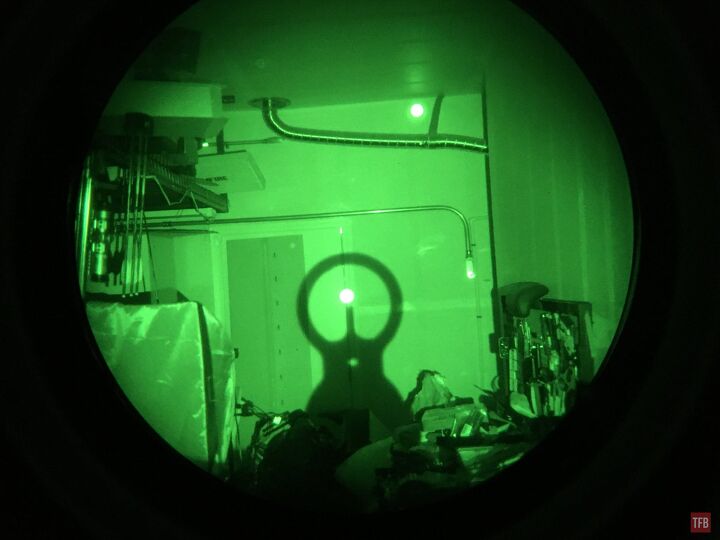
Locate an element on the screen. Image resolution: width=720 pixels, height=540 pixels. silver or metallic pipe is located at coordinates (310, 138).